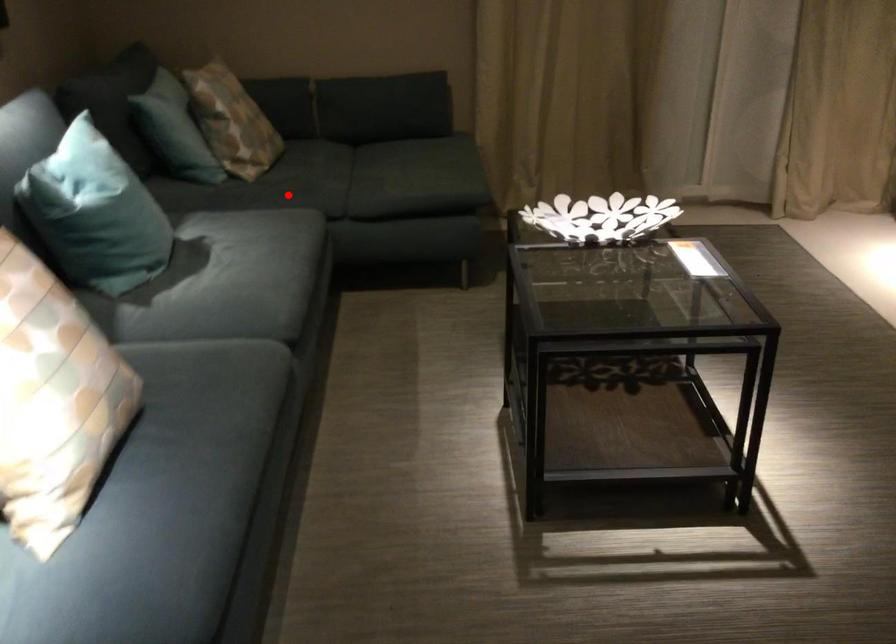
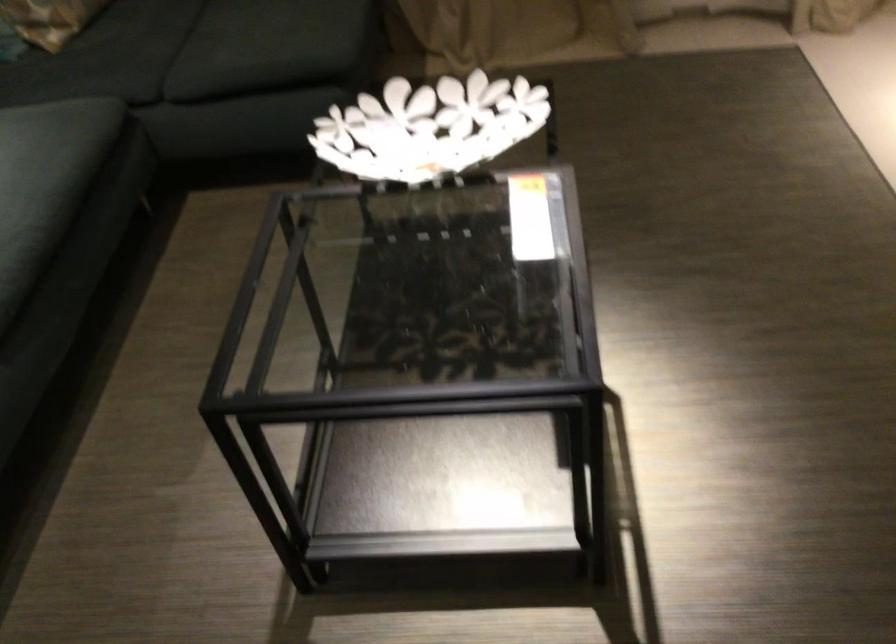
Question: A red point is marked in image1. In image2, is the corresponding 3D point closer to the camera or farther? Reply with the corresponding letter.

Choices:
 (A) The corresponding 3D point is closer.
 (B) The corresponding 3D point is farther.

Answer: (A)